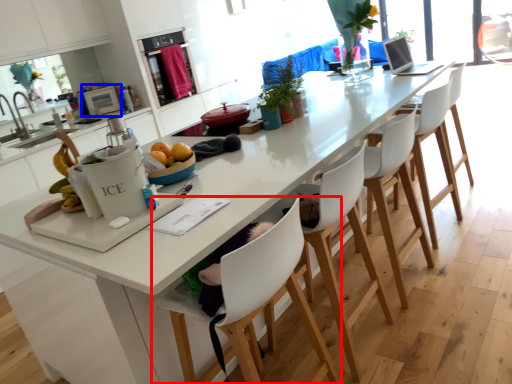
Question: Which of the following is the closest to the observer, chair (highlighted by a red box) or appliance (highlighted by a blue box)?

Choices:
 (A) chair
 (B) appliance

Answer: (A)